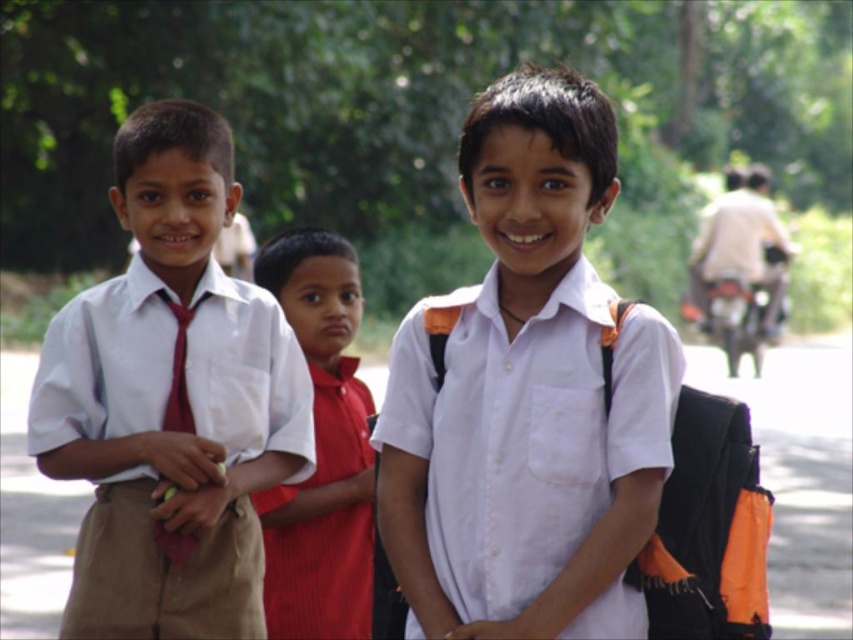
You are a photographer trying to arrange the boys for a group photo. You notice the white matte shirt at center and the matte white shirt at left in the current setup. Which boy should move to the right to align them properly for a symmetrical formation?

The matte white shirt at left should move to the right to align with the white matte shirt at center for a symmetrical formation since the white matte shirt at center is already positioned to the right of the matte white shirt at left.

You are a photographer trying to arrange three boys for a group photo. The first boy has a white matte shirt at center, the second has a matte white shirt at center. According to the current arrangement, which boy is positioned to the right of the other?

The white matte shirt at center is positioned to the right of the matte white shirt at center.